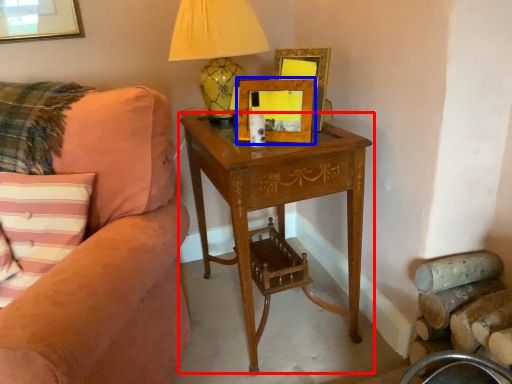
Question: Among these objects, which one is nearest to the camera, nightstand (highlighted by a red box) or picture frame (highlighted by a blue box)?

Choices:
 (A) nightstand
 (B) picture frame

Answer: (A)